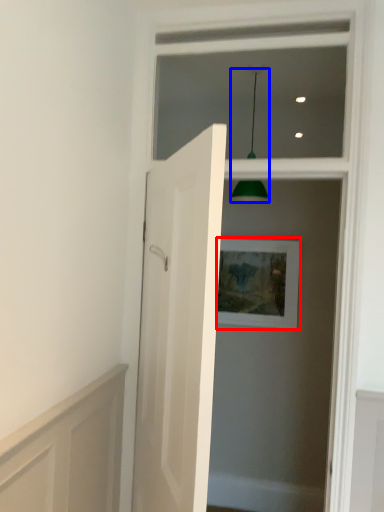
Question: Which object appears closest to the camera in this image, picture frame (highlighted by a red box) or light fixture (highlighted by a blue box)?

Choices:
 (A) picture frame
 (B) light fixture

Answer: (B)